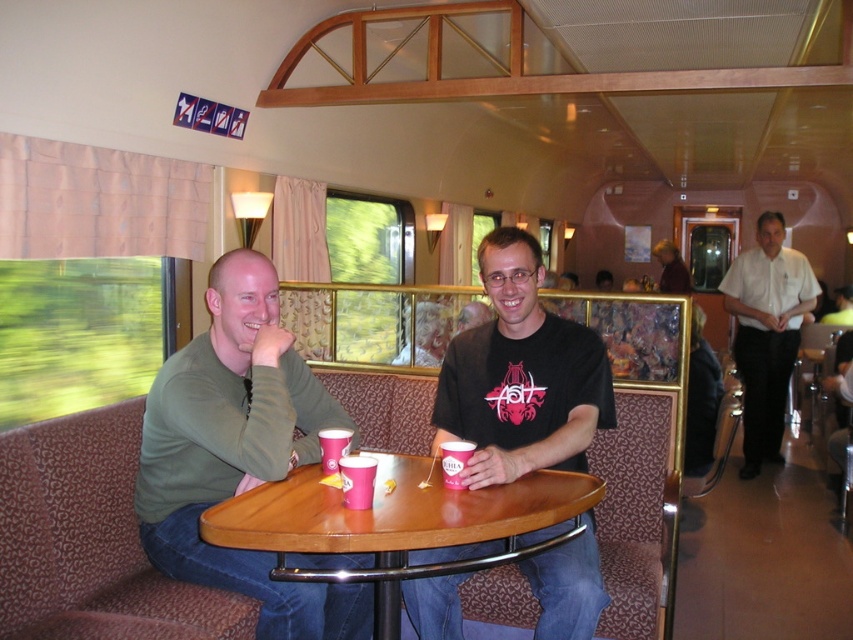
You are standing at the entrance of the train car and see the point at coordinates (x=521, y=376). What object is located at that point?

The point at coordinates (x=521, y=376) indicates the matte green shirt at center.

You are a photographer standing in the train car and want to capture both the green matte shirt at left and the brown leather jacket at center in a single frame. Based on their positions, do you think they can both fit in your camera view without moving either object?

The green matte shirt at left might be wider than brown leather jacket at center, so there is a possibility that the green matte shirt at left may occupy more space in the frame. However, since both are positioned within the train car and the photographer can adjust the camera angle or zoom, it is likely possible to include both in the frame without moving either object.

You are a photographer standing in the train car and want to take a photo of the green matte shirt at left and the wooden table at center. Which object should you focus on first if you want to capture both in the same frame?

The green matte shirt at left is positioned on the left side of wooden table at center, so you should focus on the wooden table at center first to ensure both are in the frame.